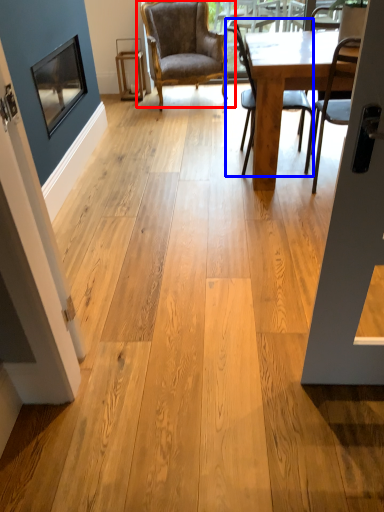
Question: Which of the following is the farthest to the observer, chair (highlighted by a red box) or chair (highlighted by a blue box)?

Choices:
 (A) chair
 (B) chair

Answer: (A)